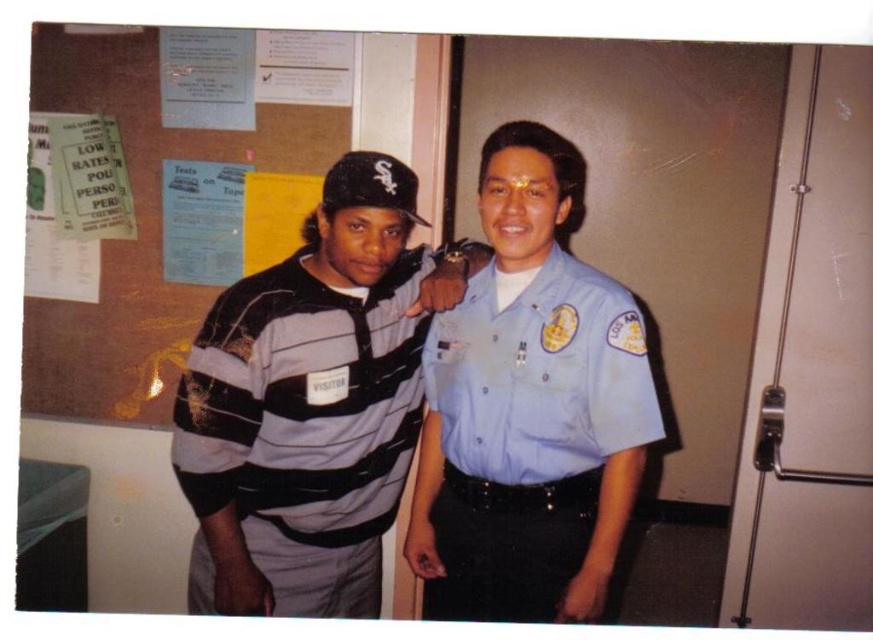
In the scene shown: You are a photographer setting up a photo shoot in the described scene. You need to ensure that both the striped knit sweater at center and the light blue fabric shirt at center are visible in the frame. Given that the camera can only capture objects up to a certain height, which of the two items should you prioritize positioning closer to the camera to ensure visibility?

The striped knit sweater at center is taller than the light blue fabric shirt at center, so you should prioritize positioning the striped knit sweater at center closer to the camera to ensure its visibility since it is taller and may require more space in the frame.

You are a visitor trying to find the restroom in this building. You see a burlap bulletin board at upper left and a striped knit sweater at center. Which object is located more to the left?

The burlap bulletin board at upper left is positioned on the left side of striped knit sweater at center, so it is more to the left.

You are a visitor standing in front of the burlap bulletin board at upper left and the light blue fabric shirt at center. You want to read the notices on the bulletin board. Can you see the notices clearly without moving your position?

The light blue fabric shirt at center is behind the burlap bulletin board at upper left, so the shirt does not block your view of the notices on the bulletin board. You can see the notices clearly without moving.